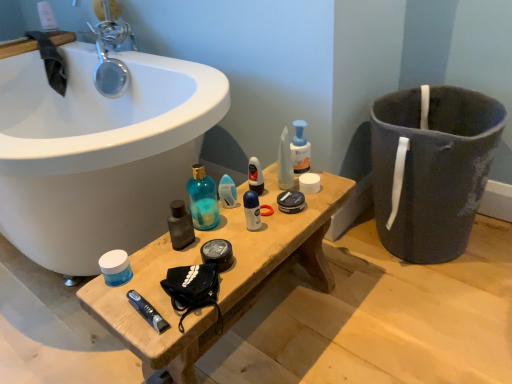
What are the coordinates of `vacant space in front of translucent plastic deodorant at center, the 3th toiletry positioned from the right` in the screenshot? It's located at (233, 235).